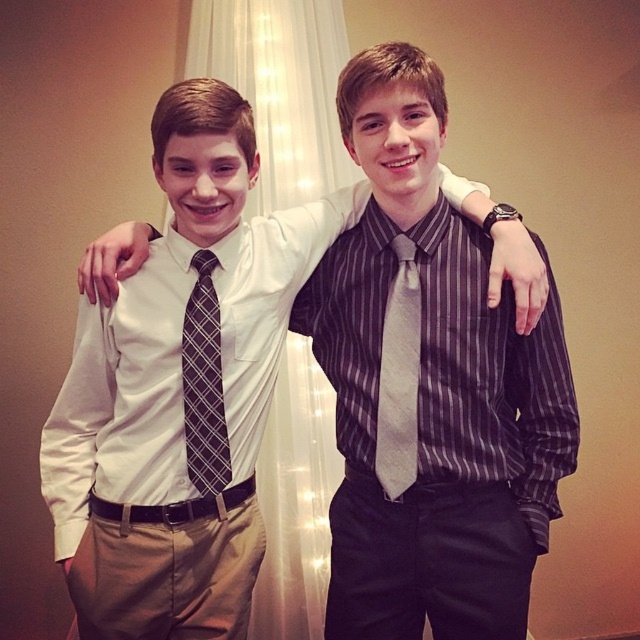
Between silky gray tie at center and plaid fabric tie at center, which one is positioned lower?

plaid fabric tie at center is below.

Does silky gray tie at center have a smaller size compared to plaid fabric tie at center?

Incorrect, silky gray tie at center is not smaller in size than plaid fabric tie at center.

Describe the element at coordinates (400, 376) in the screenshot. This screenshot has width=640, height=640. I see `silky gray tie at center` at that location.

Find the location of a particular element. This screenshot has height=640, width=640. silky gray tie at center is located at coordinates (400, 376).

From the picture: Can you confirm if white sheer curtain at center is wider than plaid fabric tie at center?

Indeed, white sheer curtain at center has a greater width compared to plaid fabric tie at center.

Is point (260, 572) in front of point (200, 476)?

No, (260, 572) is further to viewer.

In order to click on white sheer curtain at center in this screenshot , I will do `click(280, 88)`.

You are a GUI agent. You are given a task and a screenshot of the screen. Output one action in this format:
    pyautogui.click(x=<x>, y=<y>)
    Task: Click on the white sheer curtain at center
    
    Given the screenshot: What is the action you would take?
    pyautogui.click(x=280, y=88)

What do you see at coordinates (280, 88) in the screenshot? Image resolution: width=640 pixels, height=640 pixels. I see `white sheer curtain at center` at bounding box center [280, 88].

Who is taller, white sheer curtain at center or silky gray tie at center?

With more height is white sheer curtain at center.

Describe the element at coordinates (280, 88) in the screenshot. I see `white sheer curtain at center` at that location.

Find the location of a particular element. white sheer curtain at center is located at coordinates (280, 88).